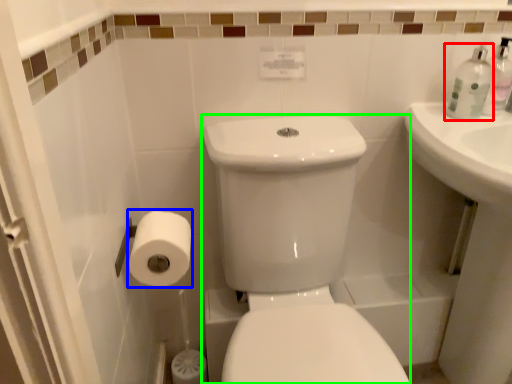
Question: Considering the real-world distances, which object is farthest from toiletry (highlighted by a red box)? toilet paper (highlighted by a blue box) or porcelain (highlighted by a green box)?

Choices:
 (A) toilet paper
 (B) porcelain

Answer: (A)